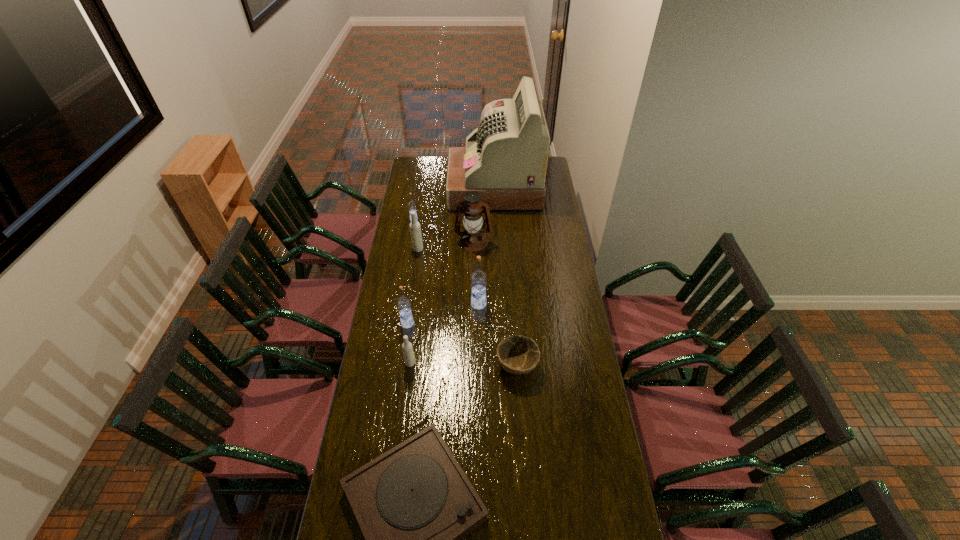
This screenshot has width=960, height=540. Find the location of `the nearer white vodka`. the nearer white vodka is located at coordinates (407, 348).

Identify the location of the farthest blue vodka. The width and height of the screenshot is (960, 540). (411, 205).

This screenshot has width=960, height=540. What are the coordinates of `the smallest blue vodka` in the screenshot? It's located at (411, 205).

Identify the location of bowl. The image size is (960, 540). (517, 354).

You are a GUI agent. You are given a task and a screenshot of the screen. Output one action in this format:
    pyautogui.click(x=<x>, y=<y>)
    Task: Click on the vacant space located 0.230m on the operating side of the tallest object
    The height and width of the screenshot is (540, 960).
    Given the screenshot: What is the action you would take?
    pyautogui.click(x=411, y=188)

Where is `vacant region located 0.070m on the operating side of the tallest object`? The width and height of the screenshot is (960, 540). vacant region located 0.070m on the operating side of the tallest object is located at coordinates (437, 188).

This screenshot has width=960, height=540. What are the coordinates of `free space located on the operating side of the tallest object` in the screenshot? It's located at (430, 188).

Locate an element on the screen. blank space located 0.280m on the side of the lantern, there is a wick adjustment knob is located at coordinates (473, 292).

This screenshot has height=540, width=960. Identify the location of free space located 0.180m on the back of the third nearest vodka. (479, 271).

Where is `vacant space situated 0.330m on the front of the bigger white vodka`? This screenshot has width=960, height=540. vacant space situated 0.330m on the front of the bigger white vodka is located at coordinates (411, 301).